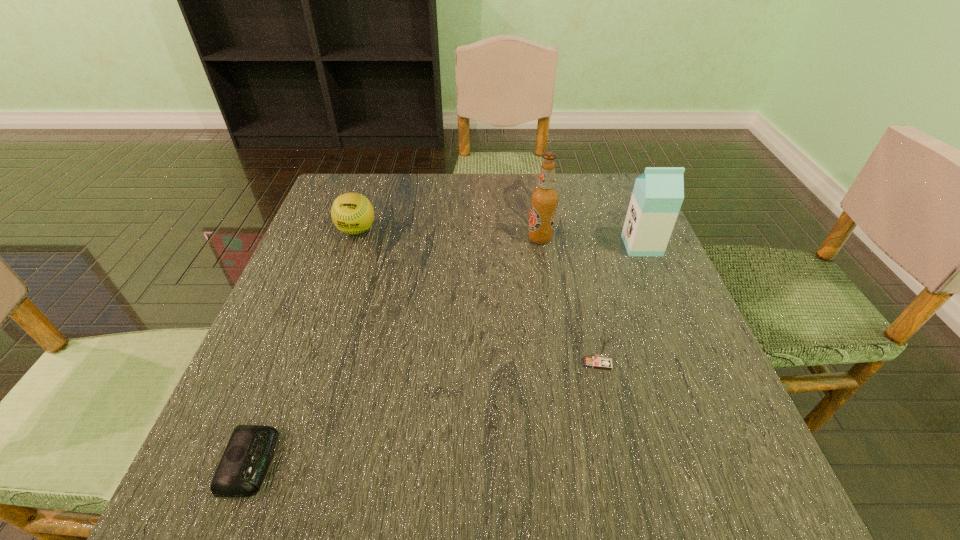
The image size is (960, 540). Find the location of `free space in the image that satisfies the following two spatial constraints: 1. on the logo side of the matchbox; 2. on the left side of the softball`. free space in the image that satisfies the following two spatial constraints: 1. on the logo side of the matchbox; 2. on the left side of the softball is located at coordinates (312, 363).

What are the coordinates of `free point that satisfies the following two spatial constraints: 1. on the front label of the milk carton; 2. on the left side of the beer bottle` in the screenshot? It's located at (541, 246).

This screenshot has width=960, height=540. In order to click on vacant space that satisfies the following two spatial constraints: 1. on the logo side of the matchbox; 2. on the right side of the softball in this screenshot , I will do `click(312, 363)`.

The height and width of the screenshot is (540, 960). Identify the location of vacant space that satisfies the following two spatial constraints: 1. on the front label of the rightmost object; 2. on the right side of the third object from right to left. (541, 246).

Where is `free space that satisfies the following two spatial constraints: 1. on the logo side of the softball; 2. on the right side of the second nearest object`? This screenshot has width=960, height=540. free space that satisfies the following two spatial constraints: 1. on the logo side of the softball; 2. on the right side of the second nearest object is located at coordinates click(x=312, y=363).

Locate an element on the screen. The image size is (960, 540). free spot that satisfies the following two spatial constraints: 1. on the front label of the second object from right to left; 2. on the right side of the third object from right to left is located at coordinates (561, 363).

The image size is (960, 540). I want to click on vacant space that satisfies the following two spatial constraints: 1. on the front label of the beer bottle; 2. on the back side of the milk carton, so click(x=541, y=246).

You are a GUI agent. You are given a task and a screenshot of the screen. Output one action in this format:
    pyautogui.click(x=<x>, y=<y>)
    Task: Click on the free space in the image that satisfies the following two spatial constraints: 1. on the front label of the matchbox; 2. on the left side of the beer bottle
    
    Given the screenshot: What is the action you would take?
    pyautogui.click(x=561, y=363)

Identify the location of vacant area that satisfies the following two spatial constraints: 1. on the logo side of the softball; 2. on the right side of the rightmost object. (351, 246).